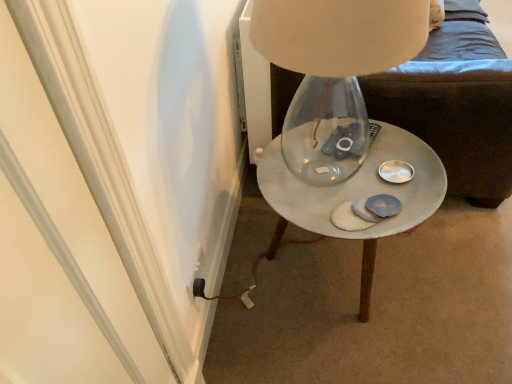
Image resolution: width=512 pixels, height=384 pixels. Identify the location of free space to the right of white marble side table at center. (461, 264).